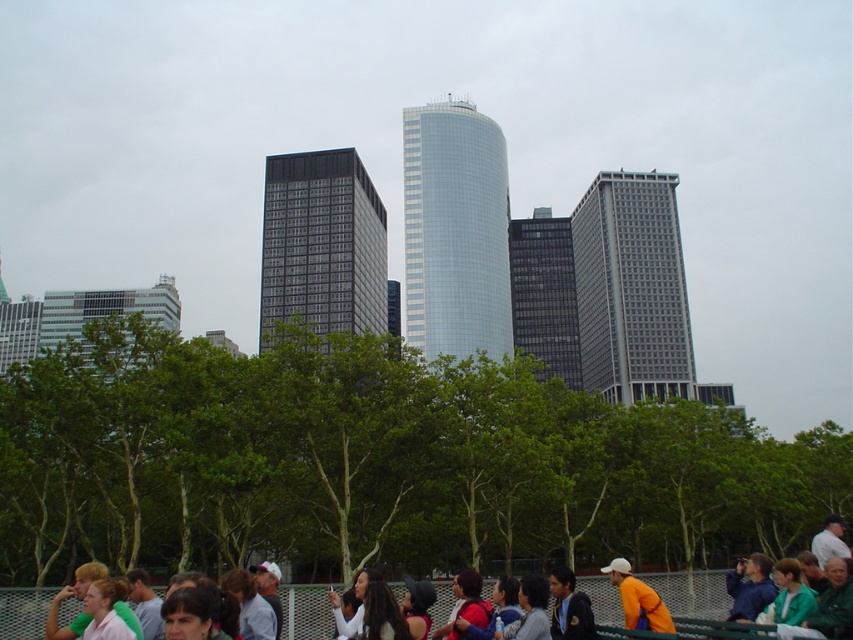
Question: Which point appears closest to the camera in this image?

Choices:
 (A) [x=471, y=221]
 (B) [x=321, y=301]
 (C) [x=553, y=244]

Answer: (B)

Question: Does gray glass skyscraper at center appear on the right side of orange fabric at lower right?

Choices:
 (A) no
 (B) yes

Answer: (B)

Question: Among these objects, which one is farthest from the camera?

Choices:
 (A) dark gray glass building at center
 (B) glassy reflective skyscraper at center
 (C) orange fabric at lower right
 (D) glassy reflective building at left

Answer: (B)

Question: Is dark gray glass building at center to the right of orange fabric at lower right from the viewer's perspective?

Choices:
 (A) no
 (B) yes

Answer: (A)

Question: Can you confirm if shiny glass skyscraper at center is bigger than glassy reflective skyscraper at center?

Choices:
 (A) no
 (B) yes

Answer: (B)

Question: Estimate the real-world distances between objects in this image. Which object is farther from the dark gray glass building at center?

Choices:
 (A) gray glass skyscraper at center
 (B) shiny glass skyscraper at center
 (C) glassy reflective building at left
 (D) glassy reflective skyscraper at center

Answer: (C)